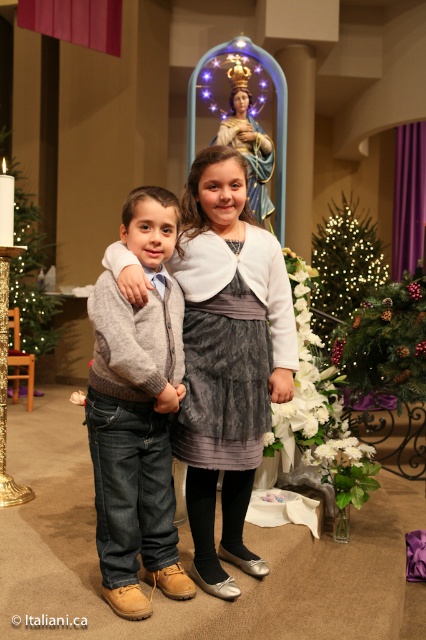
Question: Which of the following is the closest to the observer?

Choices:
 (A) illuminated green christmas tree at center
 (B) matte gray dress at center
 (C) knit sweater at center

Answer: (C)

Question: Which point is closer to the camera?

Choices:
 (A) (89, 392)
 (B) (19, 214)
 (C) (247, 497)

Answer: (A)

Question: Does illuminated green christmas tree at center come in front of green matte christmas tree at left?

Choices:
 (A) yes
 (B) no

Answer: (B)

Question: Among these points, which one is farthest from the camera?

Choices:
 (A) (347, 237)
 (B) (25, 241)

Answer: (A)

Question: Does matte gray dress at center appear over green matte christmas tree at left?

Choices:
 (A) no
 (B) yes

Answer: (A)

Question: Does knit sweater at center have a larger size compared to green matte christmas tree at left?

Choices:
 (A) no
 (B) yes

Answer: (A)